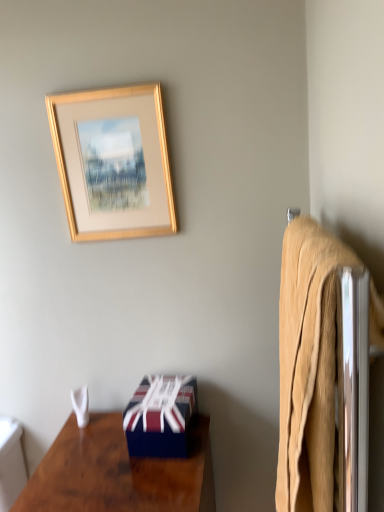
This screenshot has width=384, height=512. What are the coordinates of `free space in front of white fabric towel at lower left` in the screenshot? It's located at (85, 451).